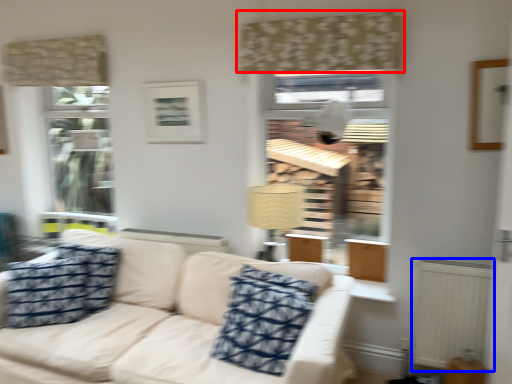
Question: Which object is closer to the camera taking this photo, curtain (highlighted by a red box) or radiator (highlighted by a blue box)?

Choices:
 (A) curtain
 (B) radiator

Answer: (B)